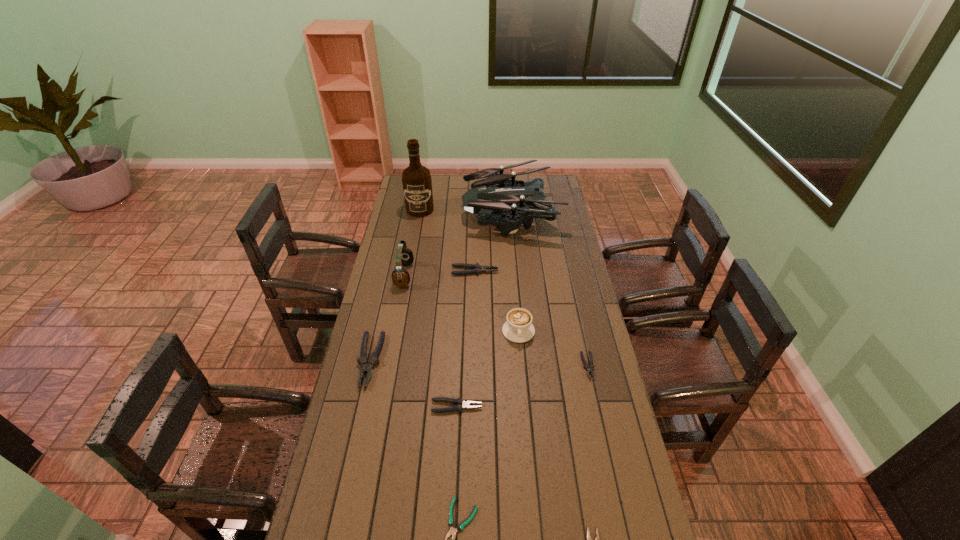
Locate which gray pliers ranks in proximity to the headset. Please provide its 2D coordinates. Your answer should be formatted as a tuple, i.e. [(x, y)], where the tuple contains the x and y coordinates of a point satisfying the conditions above.

[(474, 268)]

The width and height of the screenshot is (960, 540). What are the coordinates of `gray pliers identified as the fourth closest to the shortest pliers` in the screenshot? It's located at (474, 268).

This screenshot has height=540, width=960. I want to click on free space that satisfies the following two spatial constraints: 1. on the label of the drone; 2. on the right side of the alcohol, so click(x=420, y=212).

What are the coordinates of `free spot that satisfies the following two spatial constraints: 1. on the ear cups of the headset; 2. at the gripping part of the leftmost gray pliers` in the screenshot? It's located at (388, 360).